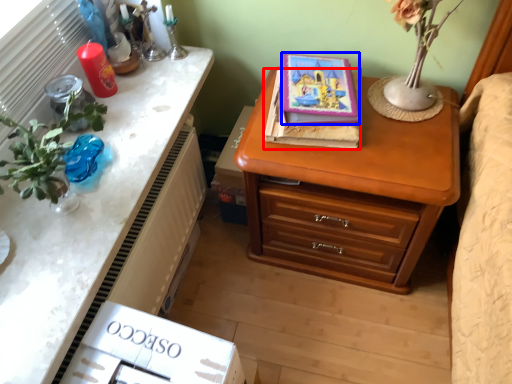
Question: Which of the following is the farthest to the observer, book (highlighted by a red box) or book (highlighted by a blue box)?

Choices:
 (A) book
 (B) book

Answer: (A)